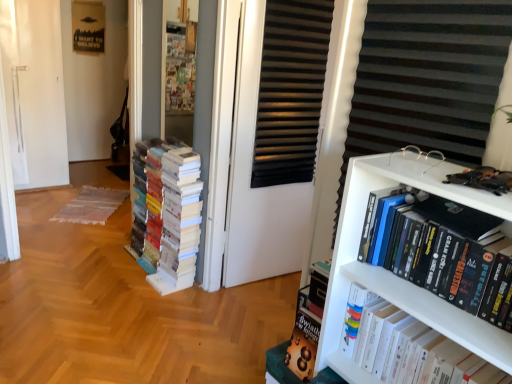
Question: Does hardcover books at right, which is counted as the first book, starting from the front, appear on the right side of hardcover book at upper right, positioned as the 2th book in left-to-right order?

Choices:
 (A) no
 (B) yes

Answer: (B)

Question: Would you say hardcover books at right, which appears as the 3th book when viewed from the back, contains hardcover book at upper right, the second book from the back?

Choices:
 (A) no
 (B) yes

Answer: (A)

Question: Does hardcover books at right, which is counted as the first book, starting from the front, come behind hardcover book at upper right, the second book from the back?

Choices:
 (A) yes
 (B) no

Answer: (B)

Question: From the image's perspective, is hardcover books at right, the third book positioned from the left, beneath hardcover book at upper right, marked as the second book in a front-to-back arrangement?

Choices:
 (A) yes
 (B) no

Answer: (B)

Question: From a real-world perspective, is hardcover books at right, which is counted as the first book, starting from the front, beneath hardcover book at upper right, which is the second book in right-to-left order?

Choices:
 (A) yes
 (B) no

Answer: (B)

Question: Does hardcover books at right, which is counted as the first book, starting from the front, have a lesser width compared to hardcover book at upper right, which is the second book in right-to-left order?

Choices:
 (A) no
 (B) yes

Answer: (B)

Question: Is white paper books at left, placed as the third book when sorted from right to left, further to the viewer compared to white plastic bookcase at right?

Choices:
 (A) no
 (B) yes

Answer: (B)

Question: Could white plastic bookcase at right be considered to be inside white paper books at left, which is the third book from front to back?

Choices:
 (A) yes
 (B) no

Answer: (B)

Question: Is white paper books at left, which is the third book from front to back, smaller than white plastic bookcase at right?

Choices:
 (A) yes
 (B) no

Answer: (B)

Question: Is white paper books at left, which is the first book in left-to-right order, in contact with white plastic bookcase at right?

Choices:
 (A) no
 (B) yes

Answer: (A)

Question: From a real-world perspective, is white paper books at left, which is the third book from front to back, physically above white plastic bookcase at right?

Choices:
 (A) yes
 (B) no

Answer: (B)

Question: Is white paper books at left, placed as the third book when sorted from right to left, facing towards white plastic bookcase at right?

Choices:
 (A) yes
 (B) no

Answer: (B)

Question: From a real-world perspective, is white paper books at left, acting as the 1th book starting from the back, below hardcover book at upper right, positioned as the 2th book in left-to-right order?

Choices:
 (A) no
 (B) yes

Answer: (B)